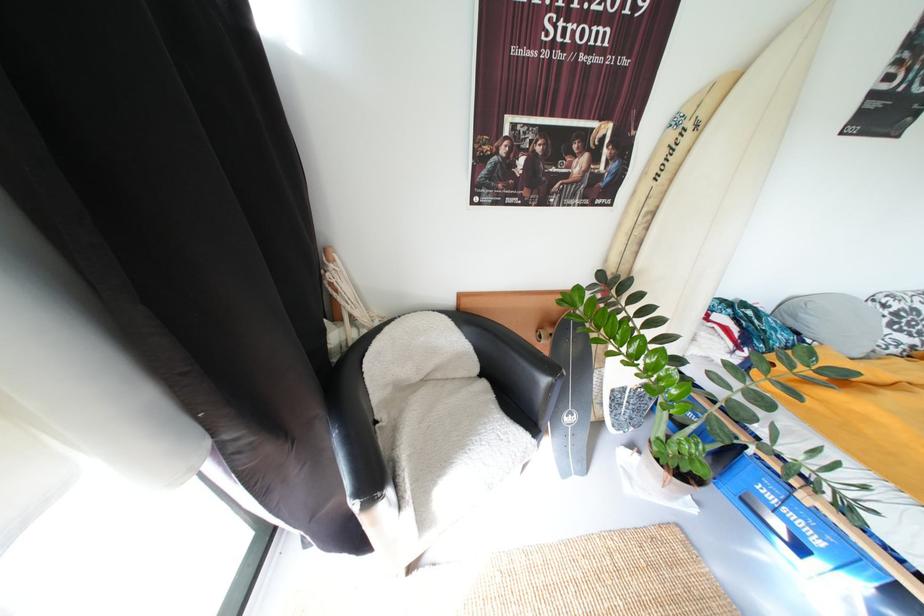
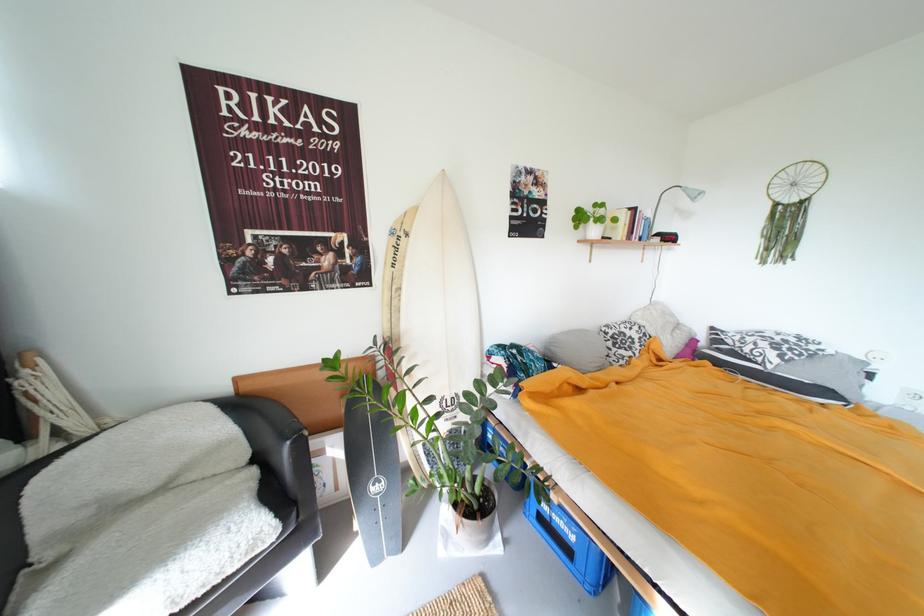
Locate, in the second image, the point that corresponds to (809,317) in the first image.

(560, 350)